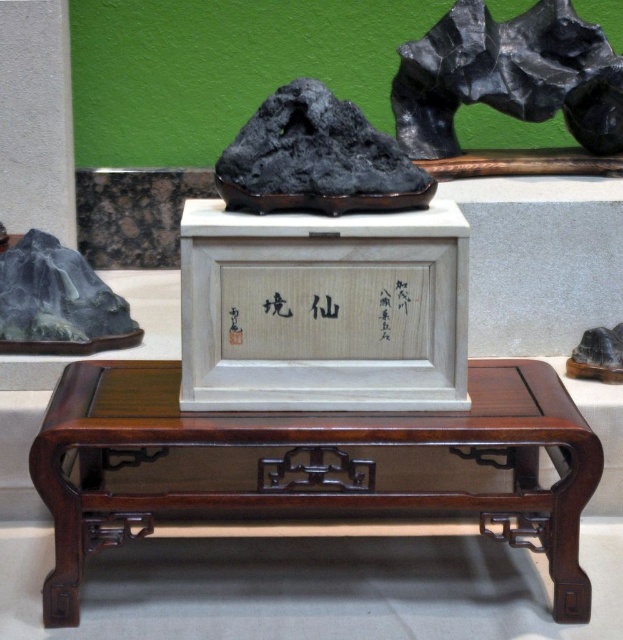
Is mahogany wood table at center to the right of black stone rock at center from the viewer's perspective?

Incorrect, mahogany wood table at center is not on the right side of black stone rock at center.

Is point (307, 465) less distant than point (245, 182)?

No, (307, 465) is further to viewer.

Where is `mahogany wood table at center`? The height and width of the screenshot is (640, 623). mahogany wood table at center is located at coordinates (302, 467).

Identify the location of mahogany wood table at center. The image size is (623, 640). (x=302, y=467).

Does black stone sculpture at upper center come behind matte black rock at left?

Yes, black stone sculpture at upper center is behind matte black rock at left.

Who is positioned more to the left, black stone sculpture at upper center or matte black rock at left?

matte black rock at left is more to the left.

You are a GUI agent. You are given a task and a screenshot of the screen. Output one action in this format:
    pyautogui.click(x=<x>, y=<y>)
    Task: Click on the black stone sculpture at upper center
    This screenshot has width=623, height=640.
    Given the screenshot: What is the action you would take?
    pyautogui.click(x=508, y=76)

Does point (107, 368) come closer to viewer compared to point (407, 145)?

Yes, it is.

Who is positioned more to the right, mahogany wood table at center or black stone sculpture at upper center?

black stone sculpture at upper center is more to the right.

Who is more forward, (358, 426) or (505, 106)?

Point (358, 426) is in front.

Where is `mahogany wood table at center`? The image size is (623, 640). mahogany wood table at center is located at coordinates (302, 467).